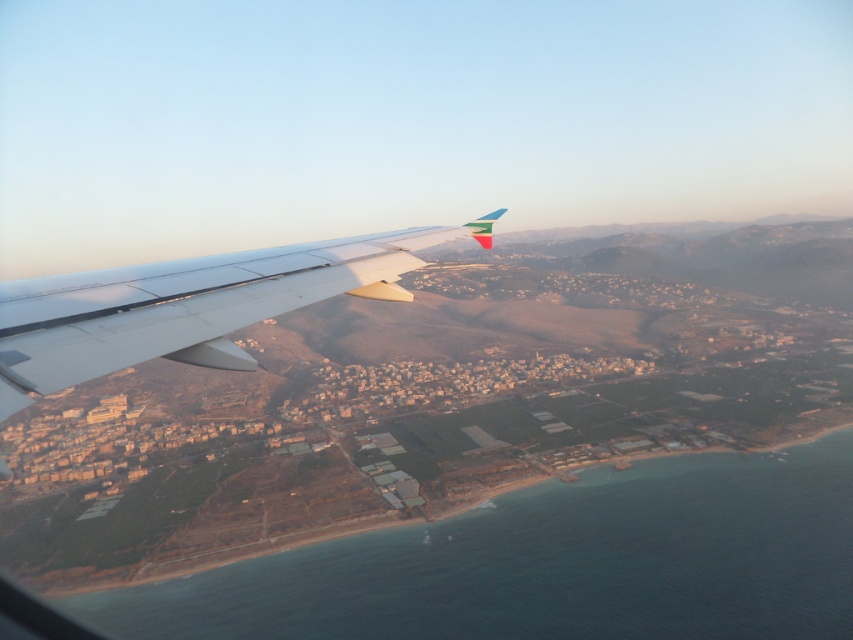
Question: Is blue water at lower left smaller than metallic gray wing at upper left?

Choices:
 (A) yes
 (B) no

Answer: (B)

Question: Which point is closer to the camera taking this photo?

Choices:
 (A) (612, 625)
 (B) (186, 332)

Answer: (B)

Question: Which point appears farthest from the camera in this image?

Choices:
 (A) (367, 243)
 (B) (448, 630)

Answer: (B)

Question: Does blue water at lower left have a smaller size compared to metallic gray wing at upper left?

Choices:
 (A) yes
 (B) no

Answer: (B)

Question: Does blue water at lower left appear over metallic gray wing at upper left?

Choices:
 (A) yes
 (B) no

Answer: (B)

Question: Which point is closer to the camera?

Choices:
 (A) (517, 515)
 (B) (483, 237)

Answer: (B)